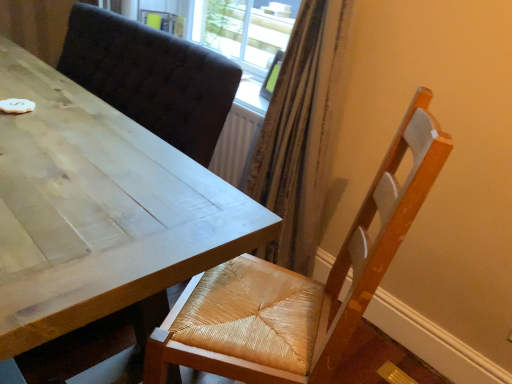
The width and height of the screenshot is (512, 384). I want to click on light wood table at upper left, so click(x=99, y=209).

This screenshot has height=384, width=512. Describe the element at coordinates (99, 209) in the screenshot. I see `light wood table at upper left` at that location.

The height and width of the screenshot is (384, 512). What do you see at coordinates (298, 285) in the screenshot? I see `woven wood chair at lower right` at bounding box center [298, 285].

Measure the distance between woven wood chair at lower right and camera.

The distance of woven wood chair at lower right from camera is 26.72 inches.

Where is `woven wood chair at lower right`? woven wood chair at lower right is located at coordinates (298, 285).

Identify the location of light wood table at upper left. This screenshot has width=512, height=384. (99, 209).

Considering the positions of objects light wood table at upper left and woven wood chair at lower right in the image provided, who is more to the right, light wood table at upper left or woven wood chair at lower right?

woven wood chair at lower right.

Which object is closer to the camera taking this photo, light wood table at upper left or woven wood chair at lower right?

Positioned in front is light wood table at upper left.

Which is more distant, (x=65, y=231) or (x=308, y=367)?

Point (x=308, y=367)

In the scene shown: From the image's perspective, between light wood table at upper left and woven wood chair at lower right, which one is located above?

light wood table at upper left, from the image's perspective.

From a real-world perspective, is light wood table at upper left over woven wood chair at lower right?

No.

Considering the sizes of objects light wood table at upper left and woven wood chair at lower right in the image provided, who is wider, light wood table at upper left or woven wood chair at lower right?

woven wood chair at lower right.

Which of these two, light wood table at upper left or woven wood chair at lower right, stands shorter?

With less height is light wood table at upper left.

Looking at the image, does light wood table at upper left seem bigger or smaller compared to woven wood chair at lower right?

In the image, light wood table at upper left appears to be larger than woven wood chair at lower right.

Is light wood table at upper left outside of woven wood chair at lower right?

Absolutely, light wood table at upper left is external to woven wood chair at lower right.

Consider the image. Would you say light wood table at upper left is a long distance from woven wood chair at lower right?

That's not correct — light wood table at upper left is a little close to woven wood chair at lower right.

Is light wood table at upper left turned away from woven wood chair at lower right?

Yes.

In the scene shown: What's the angular difference between light wood table at upper left and woven wood chair at lower right's facing directions?

light wood table at upper left and woven wood chair at lower right are facing 54.8 degrees away from each other.

Measure the distance from light wood table at upper left to woven wood chair at lower right.

light wood table at upper left is 44.19 centimeters away from woven wood chair at lower right.

Locate an element on the screen. chair that appears behind the light wood table at upper left is located at coordinates (298, 285).

Does woven wood chair at lower right appear on the right side of light wood table at upper left?

Yes, woven wood chair at lower right is to the right of light wood table at upper left.

Does woven wood chair at lower right lie behind light wood table at upper left?

That is True.

Which is farther, (393,211) or (144,208)?

The point (393,211) is farther.

From the image's perspective, which is above, woven wood chair at lower right or light wood table at upper left?

light wood table at upper left is shown above in the image.

Looking at this image, from a real-world perspective, is woven wood chair at lower right located beneath light wood table at upper left?

No, from a real-world perspective, woven wood chair at lower right is not under light wood table at upper left.

Considering the relative sizes of woven wood chair at lower right and light wood table at upper left in the image provided, is woven wood chair at lower right thinner than light wood table at upper left?

In fact, woven wood chair at lower right might be wider than light wood table at upper left.

Considering the sizes of woven wood chair at lower right and light wood table at upper left in the image, is woven wood chair at lower right taller or shorter than light wood table at upper left?

Clearly, woven wood chair at lower right is taller compared to light wood table at upper left.

Between woven wood chair at lower right and light wood table at upper left, which one has larger size?

Bigger between the two is light wood table at upper left.

Is woven wood chair at lower right not within light wood table at upper left?

woven wood chair at lower right is positioned outside light wood table at upper left.

Are woven wood chair at lower right and light wood table at upper left beside each other?

No.

Is woven wood chair at lower right oriented towards light wood table at upper left?

Yes.

Find the location of `table below the woven wood chair at lower right (from a real-world perspective)`. table below the woven wood chair at lower right (from a real-world perspective) is located at coordinates (99, 209).

The width and height of the screenshot is (512, 384). I want to click on chair behind the light wood table at upper left, so click(298, 285).

This screenshot has height=384, width=512. In the image, there is a light wood table at upper left. What are the coordinates of `chair below it (from the image's perspective)` in the screenshot? It's located at (298, 285).